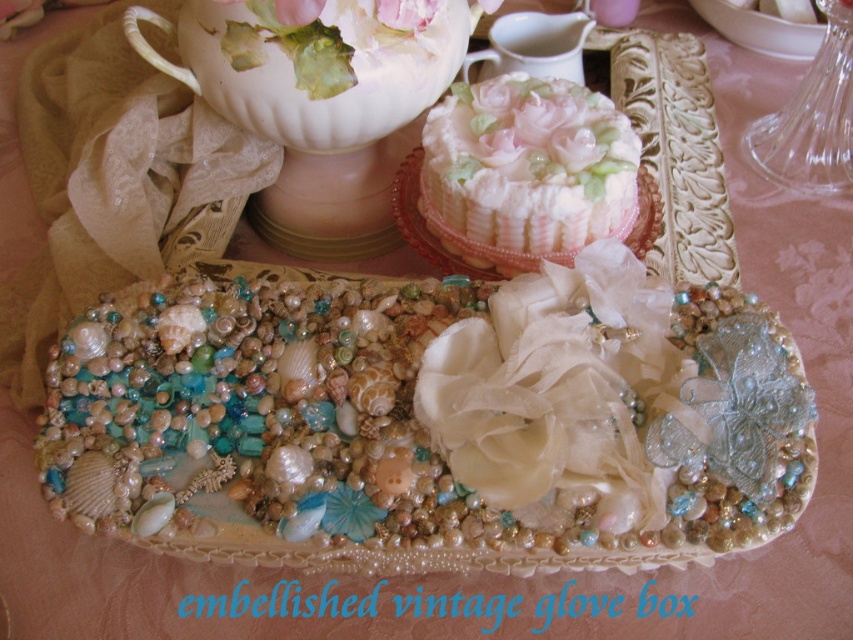
You are a guest at a tea party and see a matte porcelain teacup at upper center and a pink fabric flower at center on the vintage glove box. Which object is taller?

The matte porcelain teacup at upper center is much taller than the pink fabric flower at center.